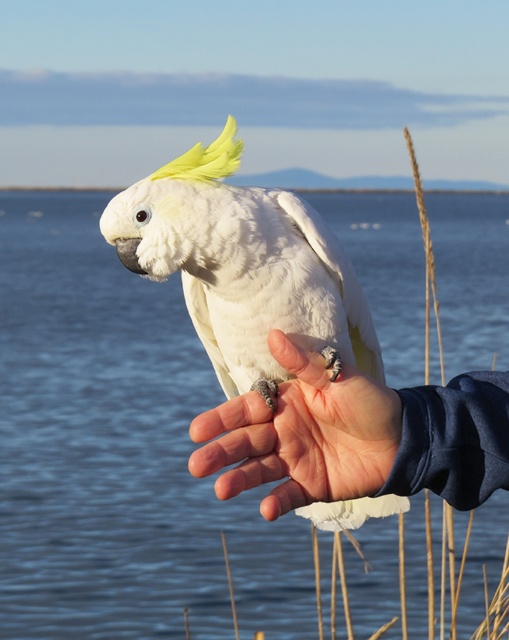
You are a photographer trying to capture a close shot of the white feathered parrot at center and the smooth skin palm at center. Which object is positioned higher in the frame?

The white feathered parrot at center is located above the smooth skin palm at center, so it is positioned higher in the frame.

You are a photographer trying to capture the reflection of the white feathered parrot at center in the transparent blue water at center. Can you confirm if the reflection will be visible?

The transparent blue water at center is positioned under the white feathered parrot at center, so the reflection of the white feathered parrot at center should be visible in the transparent blue water at center.